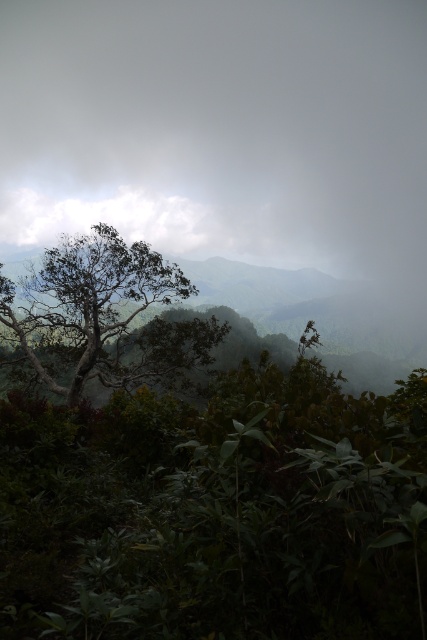
Question: Does green matte tree at center have a lesser width compared to white fluffy cloud at upper left?

Choices:
 (A) no
 (B) yes

Answer: (B)

Question: Is green matte tree at center to the right of white fluffy cloud at upper left from the viewer's perspective?

Choices:
 (A) no
 (B) yes

Answer: (B)

Question: Considering the relative positions of green matte tree at center and white fluffy cloud at upper left in the image provided, where is green matte tree at center located with respect to white fluffy cloud at upper left?

Choices:
 (A) left
 (B) right

Answer: (B)

Question: Which point appears farthest from the camera in this image?

Choices:
 (A) (14, 221)
 (B) (9, 321)

Answer: (A)

Question: Which point is closer to the camera taking this photo?

Choices:
 (A) (204, 328)
 (B) (15, 193)

Answer: (A)